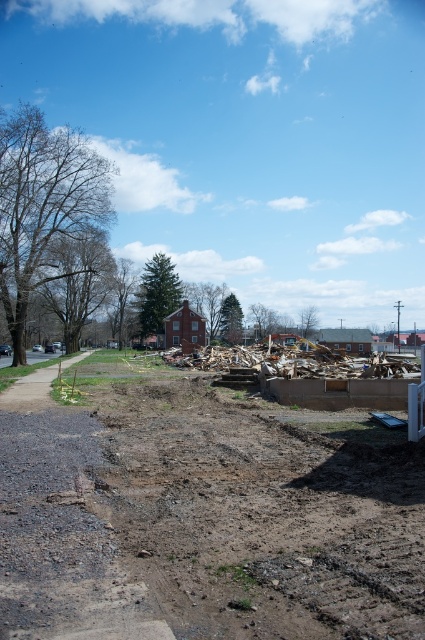
You are a construction worker who needs to place a new foundation at the coordinates given in the image. Where should you place it to avoid the dull brown dirt at center?

The dull brown dirt at center is located at point [201,513], so you should place the new foundation away from that coordinate to avoid it.